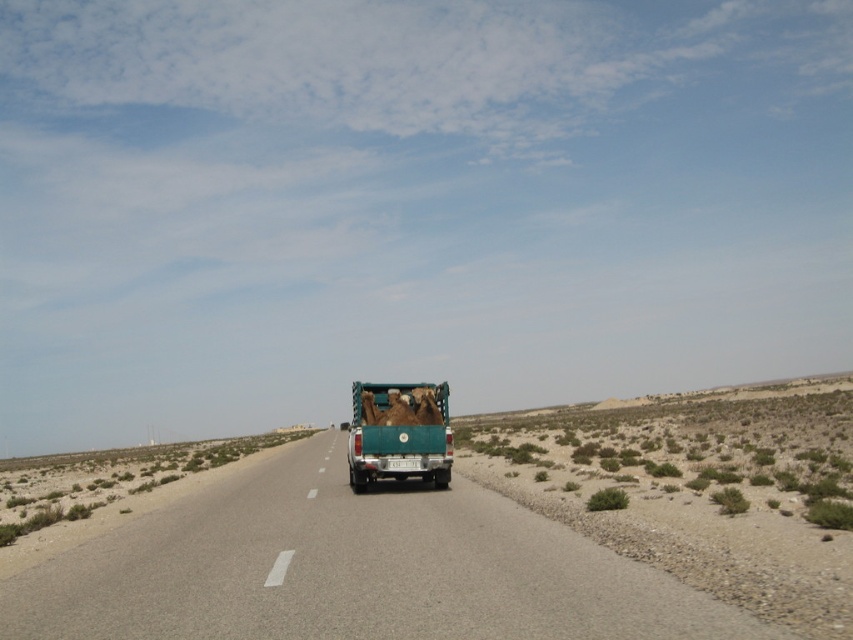
Between point (189, 506) and point (398, 444), which one is positioned in front?

Positioned in front is point (398, 444).

Can you confirm if asphalt road at center is wider than green matte truck at center?

Yes, asphalt road at center is wider than green matte truck at center.

The height and width of the screenshot is (640, 853). I want to click on asphalt road at center, so [x=351, y=570].

Locate an element on the screen. The width and height of the screenshot is (853, 640). asphalt road at center is located at coordinates (351, 570).